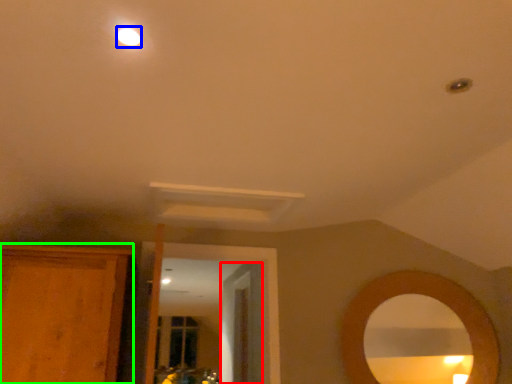
Question: Which object is the closest to the door (highlighted by a red box)? Choose among these: lighting (highlighted by a blue box) or cabinetry (highlighted by a green box).

Choices:
 (A) lighting
 (B) cabinetry

Answer: (B)